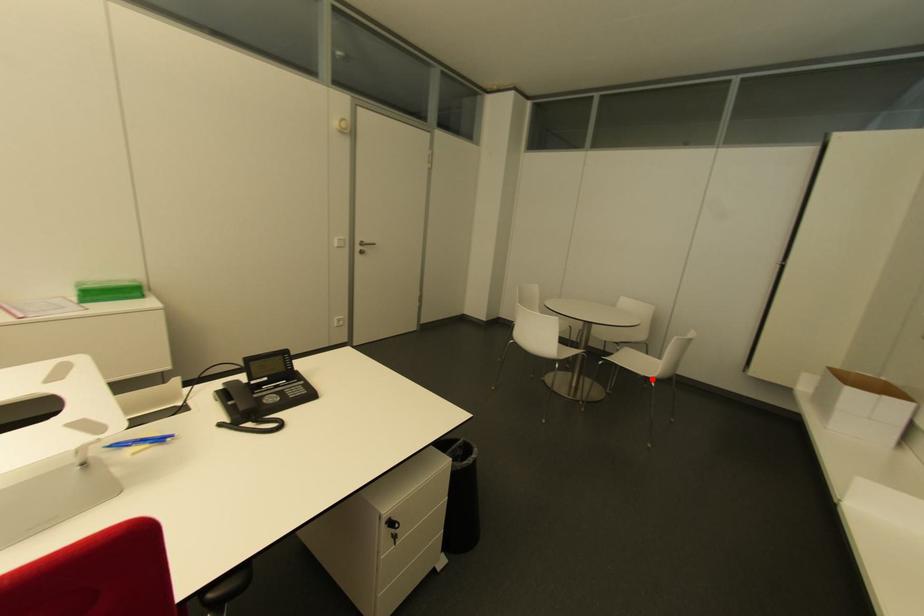
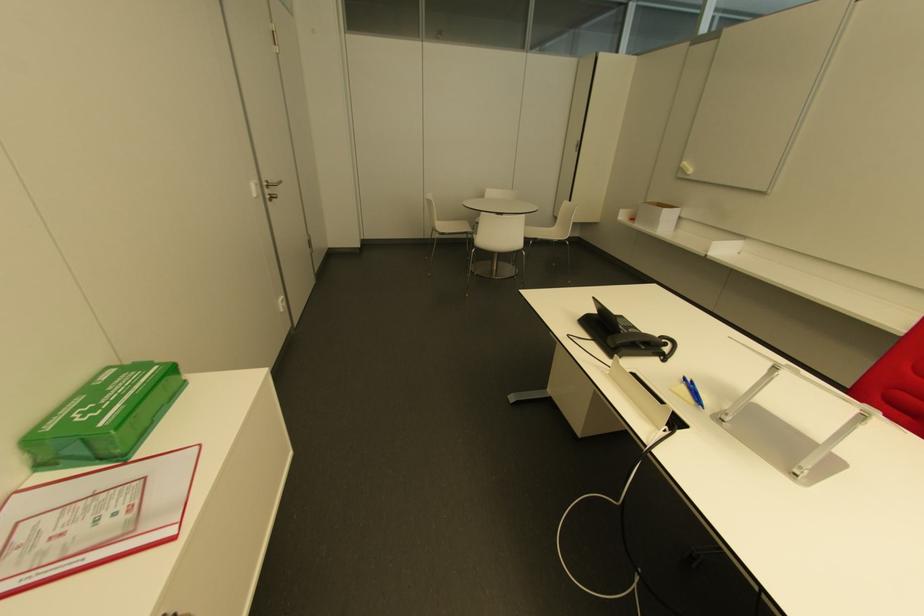
Question: A red point is marked in image1. In image2, is the corresponding 3D point closer to the camera or farther? Reply with the corresponding letter.

Choices:
 (A) The corresponding 3D point is closer.
 (B) The corresponding 3D point is farther.

Answer: (A)